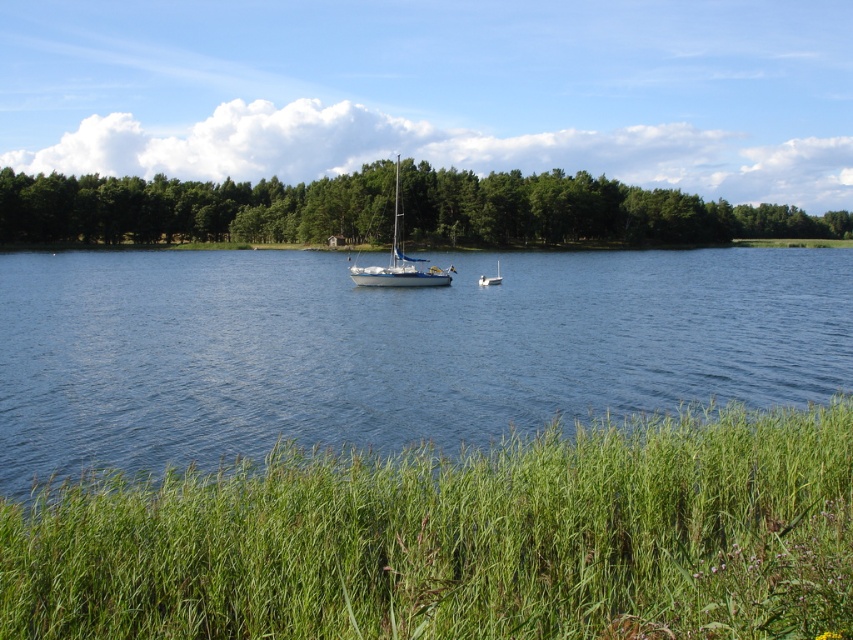
You are a photographer planning to take a photo of the green leafy trees at upper center and the white glossy boat at center. The camera you are using has a focal length of 50mm. To ensure both subjects are in focus, what should you consider about their distance apart?

The green leafy trees at upper center is 300.66 feet from the white glossy boat at center. To ensure both are in focus, you need to set the aperture to a smaller opening for a greater depth of field, as the distance between them is significant.

You are standing at the lakeside and see the point marked at coordinates (x=392, y=349). Based on the scene description, what is the location of this point relative to the two boats?

The point at (x=392, y=349) is on blue water at center, which is closer to the larger sailboat with its sails down positioned closer to the center than the smaller motorboat further away towards the right side.

You are standing at the lakeside and want to place a small buoy at each of the two points marked in the image. The first buoy is placed at point (x=425, y=385) and the second at point (x=496, y=284). If you want to retrieve both buoys, which one would you reach first without moving your position?

You would reach the buoy at point (x=425, y=385) first because it is closer to you than the other point.